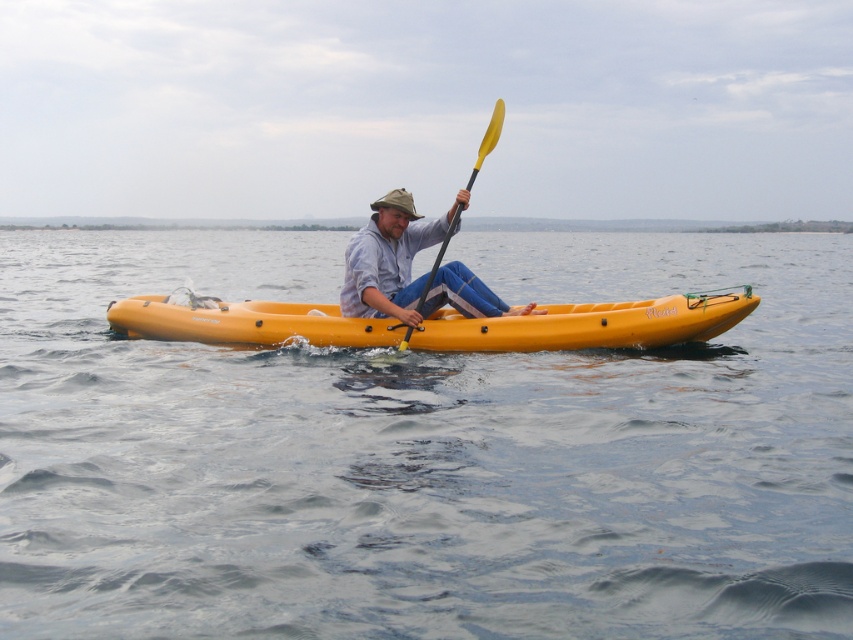
Question: Does transparent water at center appear over yellow matte kayak at center?

Choices:
 (A) yes
 (B) no

Answer: (A)

Question: Among these objects, which one is farthest from the camera?

Choices:
 (A) yellow matte paddle at center
 (B) transparent water at center
 (C) matte blue jeans at center
 (D) yellow matte kayak at center

Answer: (D)

Question: Estimate the real-world distances between objects in this image. Which object is farther from the yellow matte kayak at center?

Choices:
 (A) matte blue jeans at center
 (B) transparent water at center

Answer: (B)

Question: Is yellow matte kayak at center to the left of yellow matte paddle at center from the viewer's perspective?

Choices:
 (A) no
 (B) yes

Answer: (B)

Question: Which object is positioned farthest from the transparent water at center?

Choices:
 (A) yellow matte paddle at center
 (B) matte blue jeans at center

Answer: (A)

Question: Can you confirm if matte blue jeans at center is smaller than yellow matte paddle at center?

Choices:
 (A) yes
 (B) no

Answer: (A)